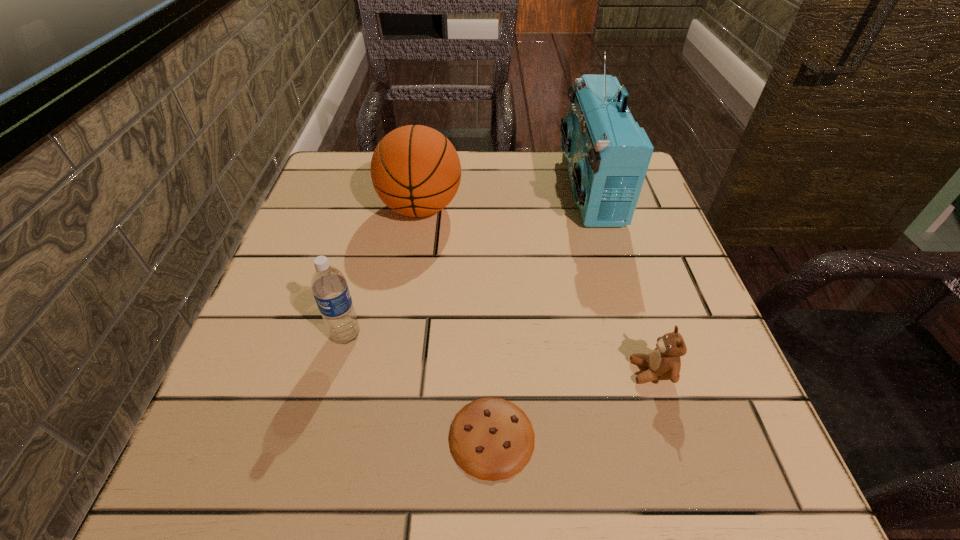
Identify the location of vacant point located between the water bottle and the tallest object. Image resolution: width=960 pixels, height=540 pixels. (468, 260).

Find the location of a particular element. object identified as the third closest to the basketball is located at coordinates (492, 439).

This screenshot has width=960, height=540. What are the coordinates of `object that is the closest one to the third farthest object` in the screenshot? It's located at pyautogui.click(x=492, y=439).